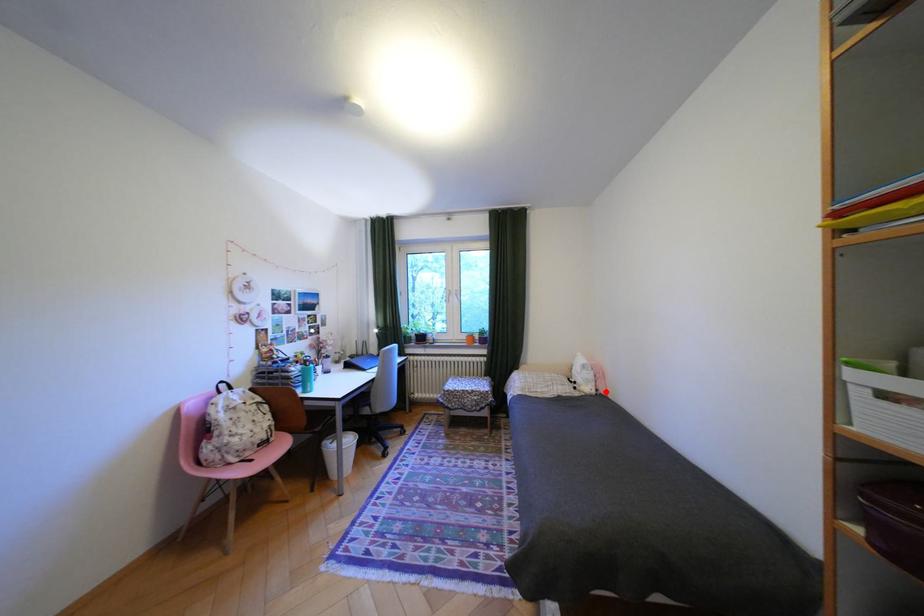
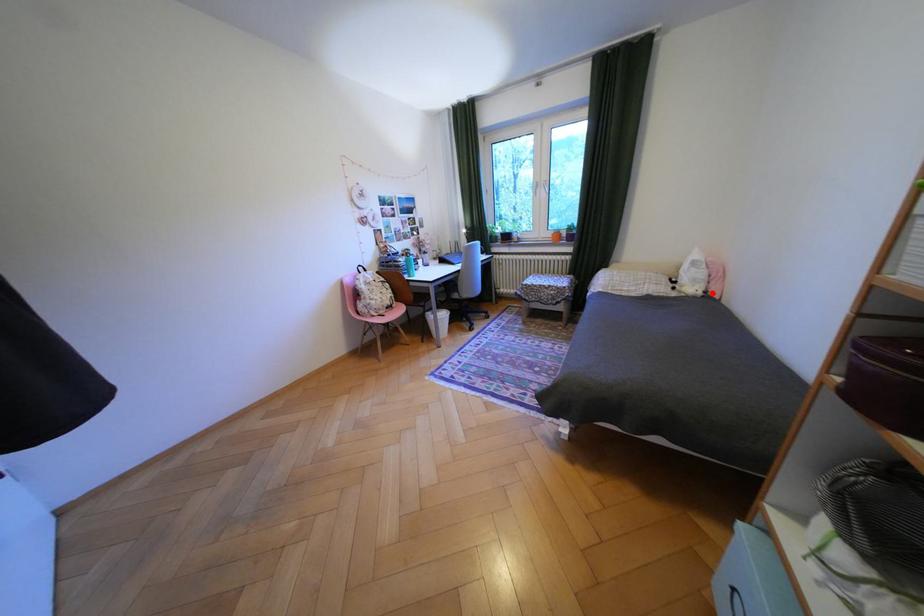
I am providing you with two images of the same scene from different viewpoints. A red point is marked on the first image and another point is marked on the second image. Are the points marked in image1 and image2 representing the same 3D position?

Yes